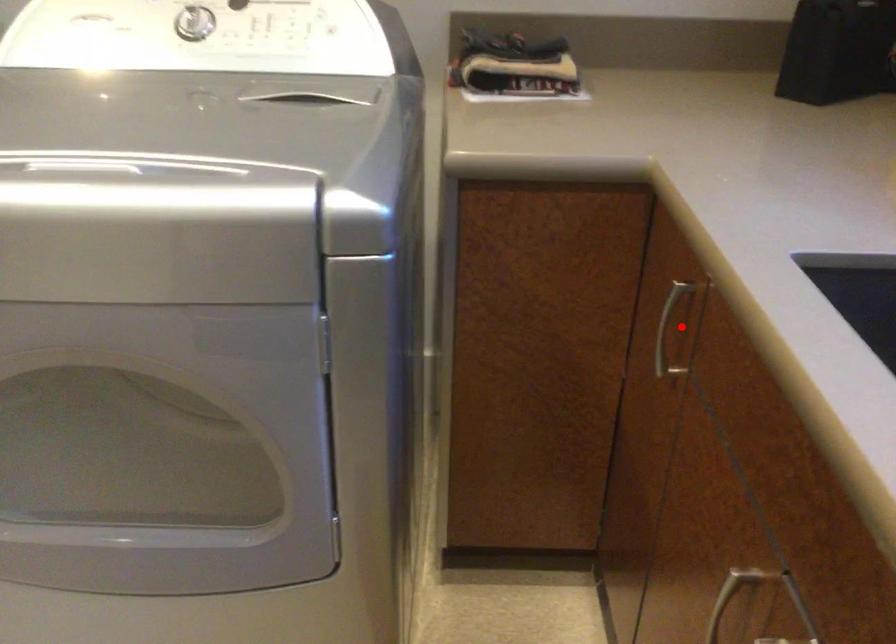
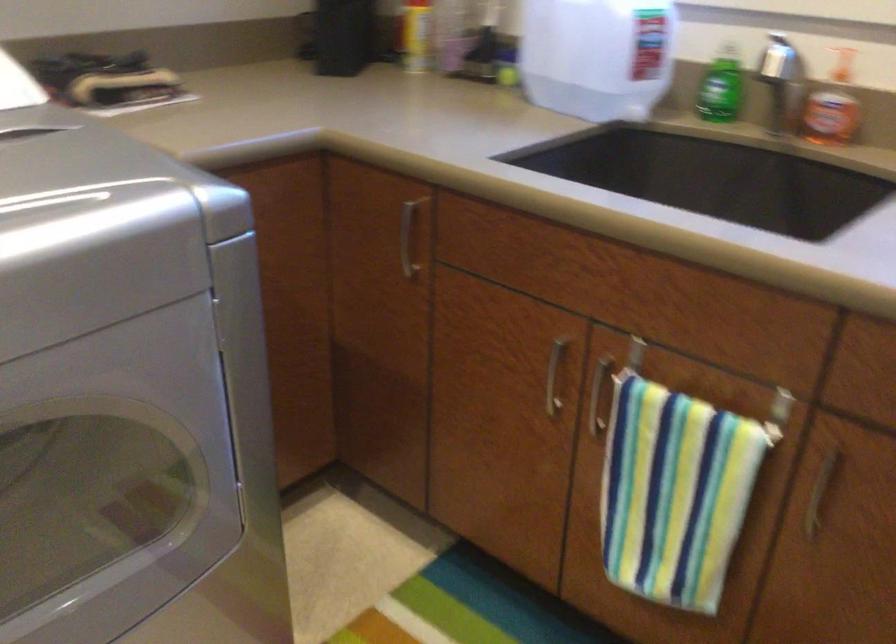
Locate, in the second image, the point that corresponds to the highlighted location in the first image.

(407, 238)